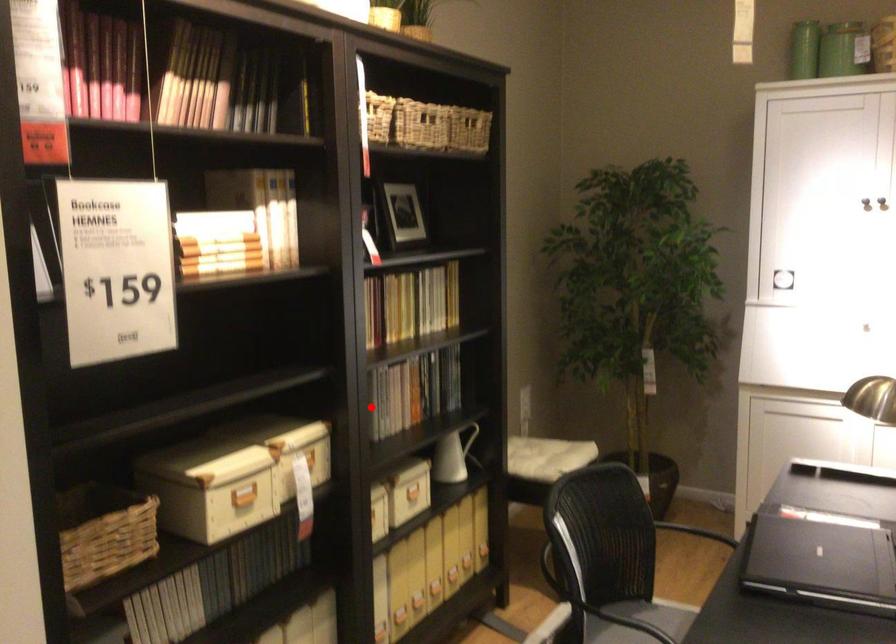
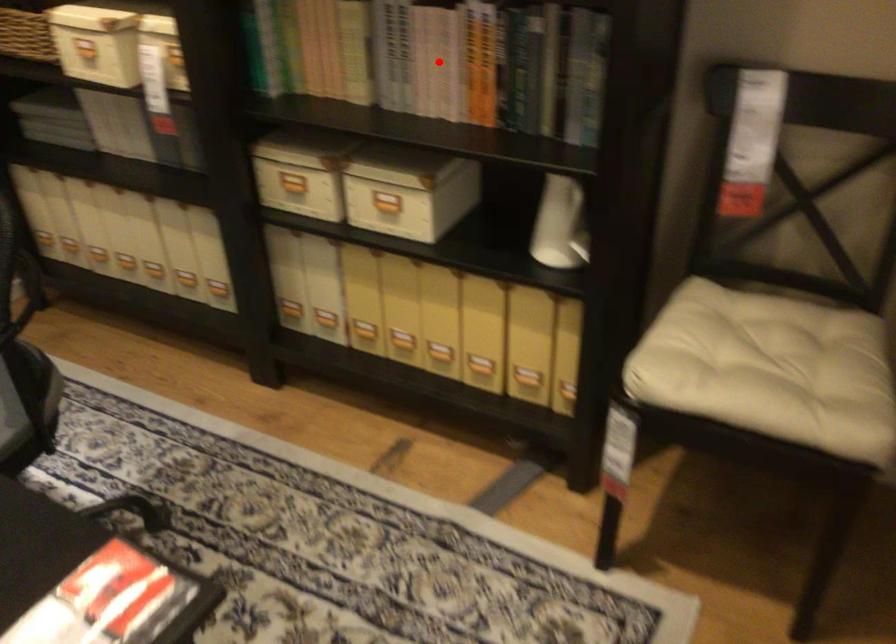
I am providing you with two images of the same scene from different viewpoints. A red point is marked on the first image and another point is marked on the second image. Is the red point in image1 aligned with the point shown in image2?

Yes